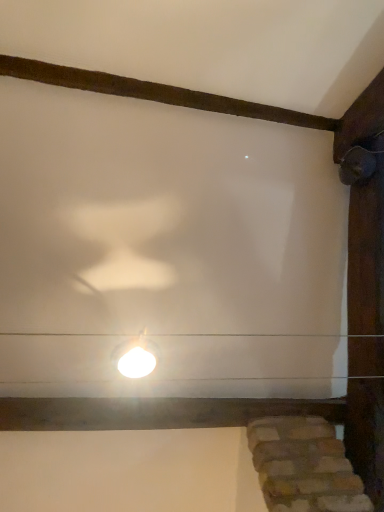
Image resolution: width=384 pixels, height=512 pixels. What do you see at coordinates (135, 357) in the screenshot?
I see `white glossy lamp at center` at bounding box center [135, 357].

Consider the image. What is the approximate width of white glossy lamp at center?

17.33 centimeters.

This screenshot has height=512, width=384. I want to click on white glossy lamp at center, so click(x=135, y=357).

Locate an element on the screen. white glossy lamp at center is located at coordinates (135, 357).